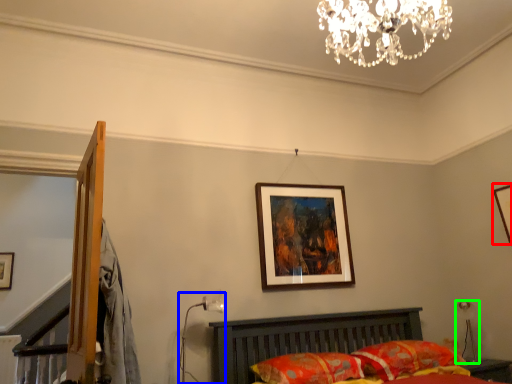
Question: Considering the real-world distances, which object is closest to picture frame (highlighted by a red box)? table lamp (highlighted by a blue box) or table lamp (highlighted by a green box).

Choices:
 (A) table lamp
 (B) table lamp

Answer: (B)